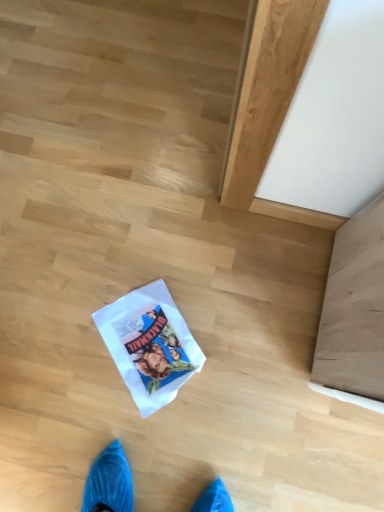
What are the coordinates of `free location above white paper comic book at center (from a real-world perspective)` in the screenshot? It's located at click(x=155, y=342).